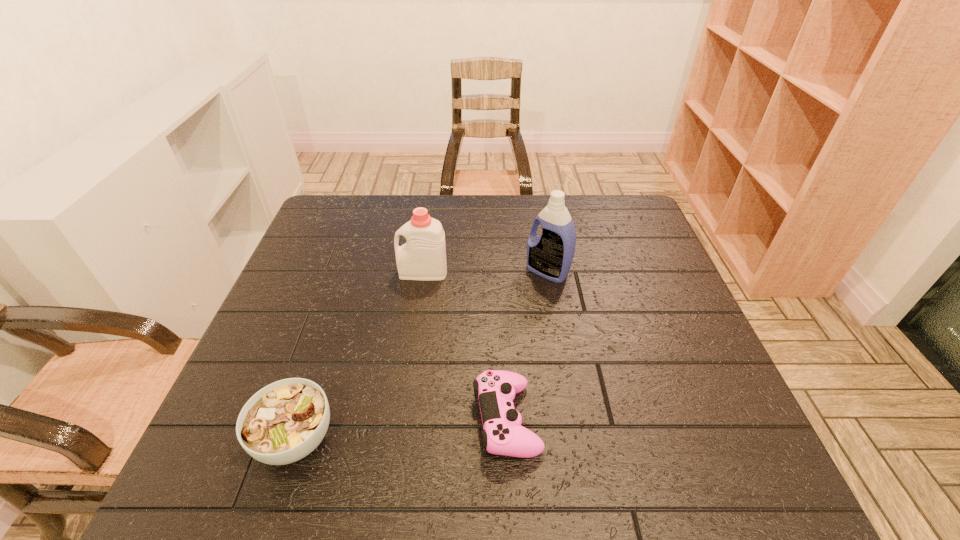
What are the coordinates of `vacant space that is in between the second shortest object and the shorter detergent` in the screenshot? It's located at (359, 355).

Where is `unoccupied area between the control and the leftmost object`? The width and height of the screenshot is (960, 540). unoccupied area between the control and the leftmost object is located at coordinates (401, 429).

This screenshot has width=960, height=540. I want to click on free point between the leftmost object and the shortest object, so click(401, 429).

You are a GUI agent. You are given a task and a screenshot of the screen. Output one action in this format:
    pyautogui.click(x=<x>, y=<y>)
    Task: Click on the empty location between the leftmost object and the right detergent
    
    Given the screenshot: What is the action you would take?
    pyautogui.click(x=421, y=355)

Locate which object is the closest to the taller detergent. Please provide its 2D coordinates. Your answer should be formatted as a tuple, i.e. [(x, y)], where the tuple contains the x and y coordinates of a point satisfying the conditions above.

[(423, 257)]

Identify which object is the third nearest to the rightmost object. Please provide its 2D coordinates. Your answer should be formatted as a tuple, i.e. [(x, y)], where the tuple contains the x and y coordinates of a point satisfying the conditions above.

[(285, 421)]

Locate an element on the screen. free space that satisfies the following two spatial constraints: 1. on the handle side of the shortest object; 2. on the right side of the shorter detergent is located at coordinates (401, 420).

Where is `free spot that satisfies the following two spatial constraints: 1. on the handle side of the shortest object; 2. on the right side of the shorter detergent`? This screenshot has height=540, width=960. free spot that satisfies the following two spatial constraints: 1. on the handle side of the shortest object; 2. on the right side of the shorter detergent is located at coordinates (401, 420).

Locate an element on the screen. The image size is (960, 540). vacant region that satisfies the following two spatial constraints: 1. on the handle side of the left detergent; 2. on the left side of the shortest object is located at coordinates (401, 420).

This screenshot has height=540, width=960. In order to click on free space in the image that satisfies the following two spatial constraints: 1. on the handle side of the left detergent; 2. on the back side of the control in this screenshot , I will do `click(401, 420)`.